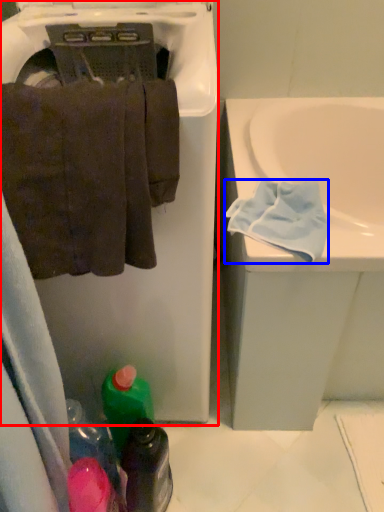
Question: Among these objects, which one is farthest to the camera, dish washer (highlighted by a red box) or bath towel (highlighted by a blue box)?

Choices:
 (A) dish washer
 (B) bath towel

Answer: (B)